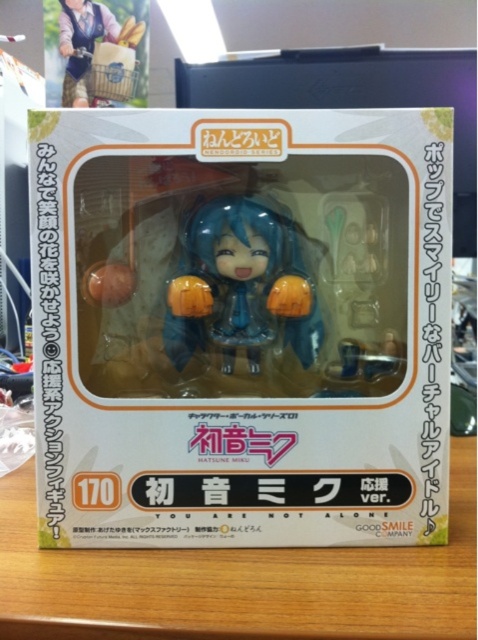
Question: Which is nearer to the white matte box at center?

Choices:
 (A) matte brown wooden basket at upper left
 (B) matte blue figure at center
 (C) yellow matte table at center

Answer: (B)

Question: Which object is the closest to the matte blue figure at center?

Choices:
 (A) yellow matte table at center
 (B) white matte box at center

Answer: (B)

Question: Is yellow matte table at center below matte blue figure at center?

Choices:
 (A) no
 (B) yes

Answer: (B)

Question: Does yellow matte table at center have a greater width compared to matte blue figure at center?

Choices:
 (A) no
 (B) yes

Answer: (B)

Question: Which point is farther to the camera?

Choices:
 (A) yellow matte table at center
 (B) matte blue figure at center

Answer: (B)

Question: Is matte blue figure at center below matte brown wooden basket at upper left?

Choices:
 (A) yes
 (B) no

Answer: (A)